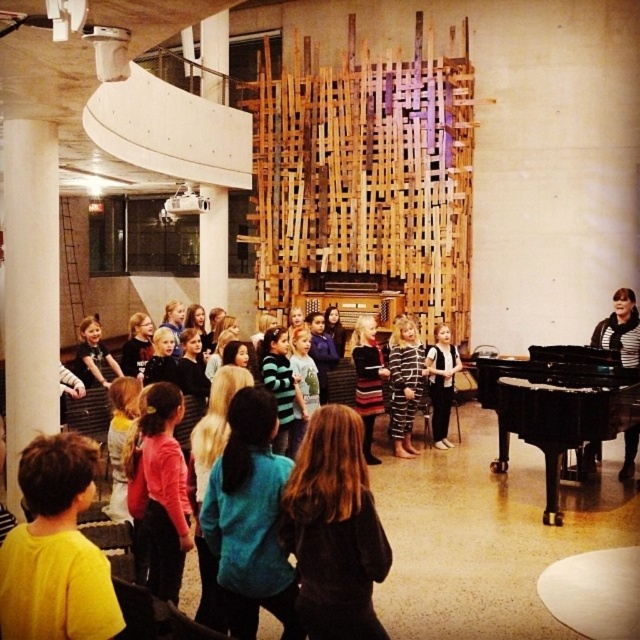
You are a stagehand setting up a microphone for the conductor. The conductor is standing at the center of the stage. The black polished piano at right is located at coordinates point 0.642, 0.870. To ensure the microphone is equidistant from both the conductor and the piano, where should you place it?

The microphone should be placed at the midpoint between the conductor at the center of the stage and the black polished piano at right, which is located at coordinates point (556, 410). The midpoint would be calculated by averaging the coordinates of both points.

You are a costume designer preparing for a school play. You have two outfits to choose from for the lead character. The first is the pink fabric shirt at center, and the second is the striped fabric dress at center. Which outfit has a wider silhouette?

The pink fabric shirt at center has a larger width than the striped fabric dress at center, so the pink fabric shirt at center has a wider silhouette.

You are a photographer trying to capture a clear shot of the striped fabric dress at center without the pink fabric shirt at center blocking it. What adjustment should you make to your camera position?

Move your camera position backward to ensure the striped fabric dress at center is no longer blocked by the pink fabric shirt at center.